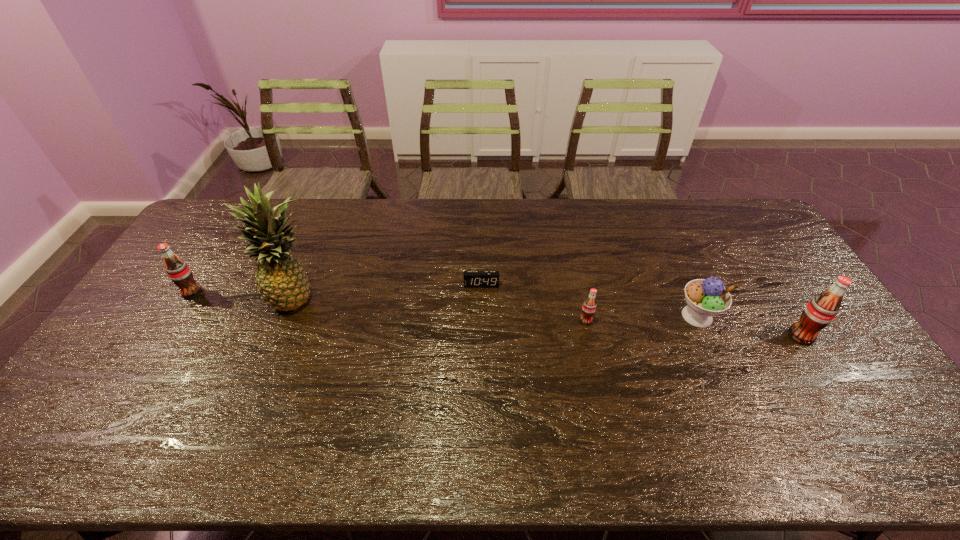
This screenshot has height=540, width=960. Find the location of `location for an additional pop_(soda) to make spacing equal`. location for an additional pop_(soda) to make spacing equal is located at coordinates (383, 307).